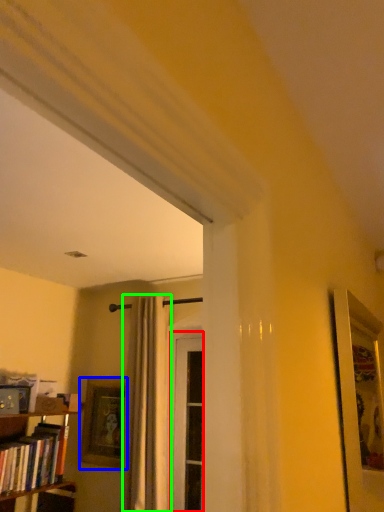
Question: Estimate the real-world distances between objects in this image. Which object is closer to screen door (highlighted by a red box), picture frame (highlighted by a blue box) or curtain (highlighted by a green box)?

Choices:
 (A) picture frame
 (B) curtain

Answer: (B)